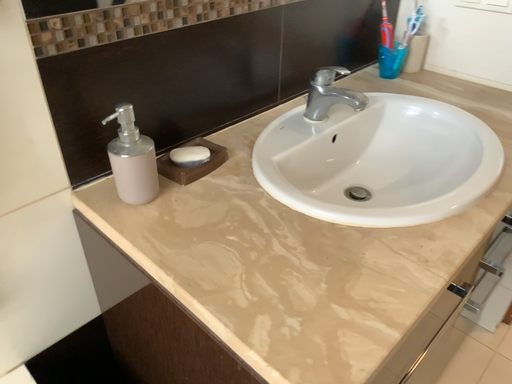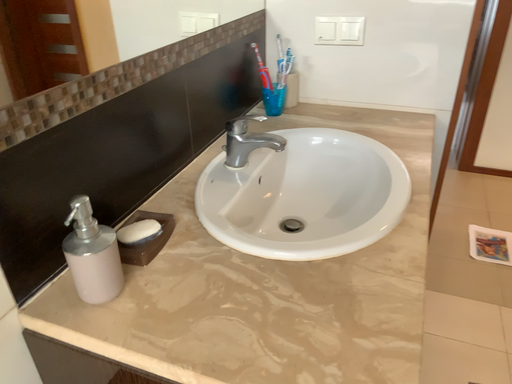
Question: How did the camera likely rotate when shooting the video?

Choices:
 (A) rotated upward
 (B) rotated downward

Answer: (A)